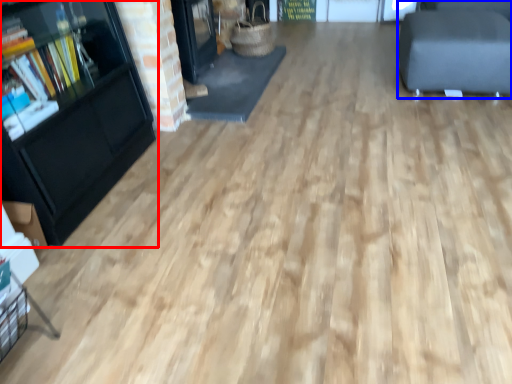
Question: Which object is further to the camera taking this photo, bookcase (highlighted by a red box) or furniture (highlighted by a blue box)?

Choices:
 (A) bookcase
 (B) furniture

Answer: (B)